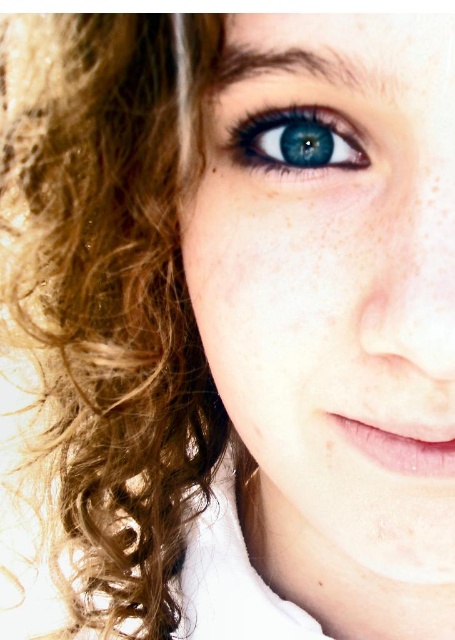
Question: Which point is farther to the camera?

Choices:
 (A) (79, 452)
 (B) (312, 580)

Answer: (A)

Question: Observing the image, what is the correct spatial positioning of blue glossy eye at center in reference to brown matte freckle at lower right?

Choices:
 (A) left
 (B) right

Answer: (A)

Question: Estimate the real-world distances between objects in this image. Which object is farther from the blue glossy eye at center?

Choices:
 (A) brown matte freckle at lower right
 (B) curly brown hair at left

Answer: (A)

Question: In this image, where is curly brown hair at left located relative to blue glossy eye at center?

Choices:
 (A) right
 (B) left

Answer: (B)

Question: Can you confirm if smooth skin face at center is smaller than blue glossy eye at center?

Choices:
 (A) no
 (B) yes

Answer: (A)

Question: Which of the following is the farthest from the observer?

Choices:
 (A) (282, 129)
 (B) (124, 173)

Answer: (B)